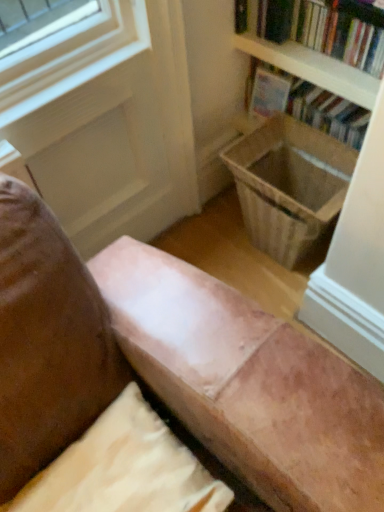
The height and width of the screenshot is (512, 384). What are the coordinates of `suede-like beige pillow at lower center` in the screenshot? It's located at (124, 469).

At what (x,y) coordinates should I click in order to perform the action: click on hardcover book at upper right, which appears as the 1th book when viewed from the front. Please return your answer as a coordinate pair (x, y). The height and width of the screenshot is (512, 384). Looking at the image, I should click on (328, 29).

You are a GUI agent. You are given a task and a screenshot of the screen. Output one action in this format:
    pyautogui.click(x=<x>, y=<y>)
    Task: Click on the hardcover book at upper right, the 1th book in the back-to-front sequence
    The height and width of the screenshot is (512, 384).
    Given the screenshot: What is the action you would take?
    pyautogui.click(x=315, y=106)

From a real-world perspective, is hardcover book at upper right, the 2th book from the front, positioned under hardcover book at upper right, which appears as the 1th book when viewed from the front, based on gravity?

Yes, from a real-world perspective, hardcover book at upper right, the 2th book from the front, is below hardcover book at upper right, which appears as the 1th book when viewed from the front.

Considering the positions of points (250, 97) and (241, 5), is point (250, 97) farther from camera compared to point (241, 5)?

Yes, it is.

How distant is hardcover book at upper right, the 2th book from the front, from hardcover book at upper right, which appears as the 2th book when viewed from the back?

hardcover book at upper right, the 2th book from the front, and hardcover book at upper right, which appears as the 2th book when viewed from the back, are 6.83 inches apart from each other.

Considering the relative positions of hardcover book at upper right, the 1th book in the back-to-front sequence, and hardcover book at upper right, which appears as the 2th book when viewed from the back, in the image provided, is hardcover book at upper right, the 1th book in the back-to-front sequence, to the left of hardcover book at upper right, which appears as the 2th book when viewed from the back, from the viewer's perspective?

In fact, hardcover book at upper right, the 1th book in the back-to-front sequence, is to the right of hardcover book at upper right, which appears as the 2th book when viewed from the back.

Are wooden laundry basket at lower right and suede-like beige pillow at lower center beside each other?

No, wooden laundry basket at lower right is not touching suede-like beige pillow at lower center.

Is wooden laundry basket at lower right inside the boundaries of suede-like beige pillow at lower center, or outside?

wooden laundry basket at lower right is not inside suede-like beige pillow at lower center, it's outside.

Who is shorter, wooden laundry basket at lower right or suede-like beige pillow at lower center?

wooden laundry basket at lower right.

Between wooden laundry basket at lower right and suede-like beige pillow at lower center, which one has larger size?

Bigger between the two is suede-like beige pillow at lower center.

Based on the photo, is hardcover book at upper right, which appears as the 1th book when viewed from the front, taller or shorter than suede-like beige pillow at lower center?

hardcover book at upper right, which appears as the 1th book when viewed from the front, is taller than suede-like beige pillow at lower center.

Is hardcover book at upper right, which appears as the 1th book when viewed from the front, inside the boundaries of suede-like beige pillow at lower center, or outside?

hardcover book at upper right, which appears as the 1th book when viewed from the front, is outside suede-like beige pillow at lower center.

Is hardcover book at upper right, which appears as the 2th book when viewed from the back, placed right next to suede-like beige pillow at lower center?

No, hardcover book at upper right, which appears as the 2th book when viewed from the back, is not in contact with suede-like beige pillow at lower center.

Considering the relative sizes of hardcover book at upper right, which appears as the 2th book when viewed from the back, and suede-like beige pillow at lower center in the image provided, is hardcover book at upper right, which appears as the 2th book when viewed from the back, wider than suede-like beige pillow at lower center?

Incorrect, the width of hardcover book at upper right, which appears as the 2th book when viewed from the back, does not surpass that of suede-like beige pillow at lower center.

Is there a large distance between hardcover book at upper right, the 1th book in the back-to-front sequence, and wooden laundry basket at lower right?

No.

From the picture: Which of these two, hardcover book at upper right, the 1th book in the back-to-front sequence, or wooden laundry basket at lower right, is thinner?

hardcover book at upper right, the 1th book in the back-to-front sequence.

Between hardcover book at upper right, the 2th book from the front, and wooden laundry basket at lower right, which one has smaller size?

With smaller size is wooden laundry basket at lower right.

From a real-world perspective, who is located higher, hardcover book at upper right, the 1th book in the back-to-front sequence, or wooden laundry basket at lower right?

hardcover book at upper right, the 1th book in the back-to-front sequence, is physically above.

How different are the orientations of suede-like beige pillow at lower center and hardcover book at upper right, the 1th book in the back-to-front sequence, in degrees?

91.5 degrees.

Between suede-like beige pillow at lower center and hardcover book at upper right, the 2th book from the front, which one appears on the right side from the viewer's perspective?

hardcover book at upper right, the 2th book from the front, is more to the right.

Based on the photo, measure the distance between suede-like beige pillow at lower center and hardcover book at upper right, the 1th book in the back-to-front sequence.

suede-like beige pillow at lower center is 3.46 feet from hardcover book at upper right, the 1th book in the back-to-front sequence.

Which of these two, suede-like beige pillow at lower center or hardcover book at upper right, the 2th book from the front, is wider?

With larger width is suede-like beige pillow at lower center.

Consider the image. Which object is closer to the camera, suede-like beige pillow at lower center or wooden laundry basket at lower right?

Positioned in front is suede-like beige pillow at lower center.

Which of these two, suede-like beige pillow at lower center or wooden laundry basket at lower right, stands shorter?

wooden laundry basket at lower right is shorter.

Could you tell me if suede-like beige pillow at lower center is turned towards wooden laundry basket at lower right?

No, suede-like beige pillow at lower center does not turn towards wooden laundry basket at lower right.

Looking at this image, how far apart are suede-like beige pillow at lower center and wooden laundry basket at lower right?

suede-like beige pillow at lower center and wooden laundry basket at lower right are 86.22 centimeters apart.

Does point (343, 3) appear closer or farther from the camera than point (286, 211)?

Point (343, 3) is positioned closer to the camera compared to point (286, 211).

Based on their positions, is hardcover book at upper right, which appears as the 1th book when viewed from the front, located to the left or right of wooden laundry basket at lower right?

In the image, hardcover book at upper right, which appears as the 1th book when viewed from the front, appears on the right side of wooden laundry basket at lower right.

Is hardcover book at upper right, which appears as the 2th book when viewed from the back, positioned with its back to wooden laundry basket at lower right?

No, wooden laundry basket at lower right is not at the back of hardcover book at upper right, which appears as the 2th book when viewed from the back.

Is hardcover book at upper right, which appears as the 1th book when viewed from the front, directly adjacent to wooden laundry basket at lower right?

They are not placed beside each other.

The image size is (384, 512). Find the location of `book above the hardcover book at upper right, the 2th book from the front (from the image's perspective)`. book above the hardcover book at upper right, the 2th book from the front (from the image's perspective) is located at coordinates (328, 29).

In the image, there is a wooden laundry basket at lower right. Identify the location of pillow below it (from the image's perspective). (124, 469).

Based on their spatial positions, is wooden laundry basket at lower right or hardcover book at upper right, which appears as the 1th book when viewed from the front, closer to suede-like beige pillow at lower center?

wooden laundry basket at lower right is positioned closer to the anchor suede-like beige pillow at lower center.

Based on their spatial positions, is wooden laundry basket at lower right or suede-like beige pillow at lower center closer to hardcover book at upper right, which appears as the 2th book when viewed from the back?

wooden laundry basket at lower right is positioned closer to the anchor hardcover book at upper right, which appears as the 2th book when viewed from the back.

Looking at the image, which one is located closer to wooden laundry basket at lower right, hardcover book at upper right, the 2th book from the front, or hardcover book at upper right, which appears as the 1th book when viewed from the front?

Based on the image, hardcover book at upper right, the 2th book from the front, appears to be nearer to wooden laundry basket at lower right.

From the picture: Which object lies nearer to the anchor point suede-like beige pillow at lower center, wooden laundry basket at lower right or hardcover book at upper right, the 1th book in the back-to-front sequence?

The object closer to suede-like beige pillow at lower center is wooden laundry basket at lower right.

Which object lies further to the anchor point hardcover book at upper right, the 1th book in the back-to-front sequence, suede-like beige pillow at lower center or hardcover book at upper right, which appears as the 1th book when viewed from the front?

suede-like beige pillow at lower center is positioned further to the anchor hardcover book at upper right, the 1th book in the back-to-front sequence.

Considering their positions, is wooden laundry basket at lower right positioned further to hardcover book at upper right, which appears as the 1th book when viewed from the front, than hardcover book at upper right, the 2th book from the front?

wooden laundry basket at lower right.

Consider the image. Considering their positions, is suede-like beige pillow at lower center positioned closer to hardcover book at upper right, which appears as the 1th book when viewed from the front, than wooden laundry basket at lower right?

wooden laundry basket at lower right is closer to hardcover book at upper right, which appears as the 1th book when viewed from the front.

Considering their positions, is hardcover book at upper right, the 1th book in the back-to-front sequence, positioned closer to wooden laundry basket at lower right than suede-like beige pillow at lower center?

The object closer to wooden laundry basket at lower right is hardcover book at upper right, the 1th book in the back-to-front sequence.

Identify the location of laundry basket that lies between hardcover book at upper right, which appears as the 1th book when viewed from the front, and suede-like beige pillow at lower center from top to bottom. Image resolution: width=384 pixels, height=512 pixels. (289, 185).

The width and height of the screenshot is (384, 512). I want to click on book between hardcover book at upper right, which appears as the 2th book when viewed from the back, and suede-like beige pillow at lower center, in the vertical direction, so click(x=315, y=106).

In order to click on laundry basket between hardcover book at upper right, the 2th book from the front, and suede-like beige pillow at lower center from top to bottom in this screenshot , I will do `click(289, 185)`.

Find the location of a particular element. The image size is (384, 512). book between hardcover book at upper right, which appears as the 2th book when viewed from the back, and wooden laundry basket at lower right vertically is located at coordinates (315, 106).